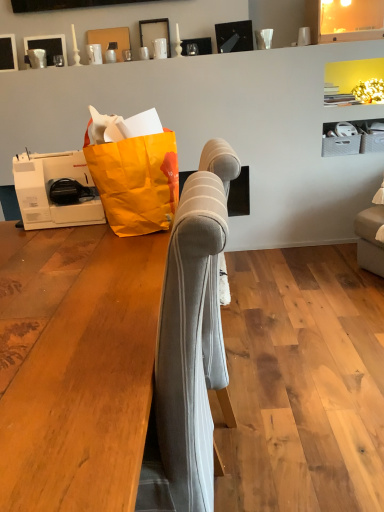
Question: From their relative heights in the image, would you say light gray fabric sofa at center is taller or shorter than matte black picture frame at upper left, arranged as the second picture frame when viewed from the right?

Choices:
 (A) short
 (B) tall

Answer: (B)

Question: From the image's perspective, is light gray fabric sofa at center located above or below matte black picture frame at upper left, arranged as the second picture frame when viewed from the right?

Choices:
 (A) below
 (B) above

Answer: (A)

Question: Which is farther from the matte black picture frame at upper center, the first picture frame from the right?

Choices:
 (A) matte black picture frame at upper left, acting as the 3th picture frame starting from the right
 (B) orange paper grocery bag at left
 (C) light gray fabric sofa at center
 (D) matte black picture frame at upper left, which is the 2th picture frame from left to right

Answer: (C)

Question: Estimate the real-world distances between objects in this image. Which object is closer to the matte black picture frame at upper center, the first picture frame from the right?

Choices:
 (A) matte black picture frame at upper left, which is the 2th picture frame from left to right
 (B) orange paper grocery bag at left
 (C) light gray fabric sofa at center
 (D) matte black picture frame at upper left, acting as the 3th picture frame starting from the right

Answer: (A)